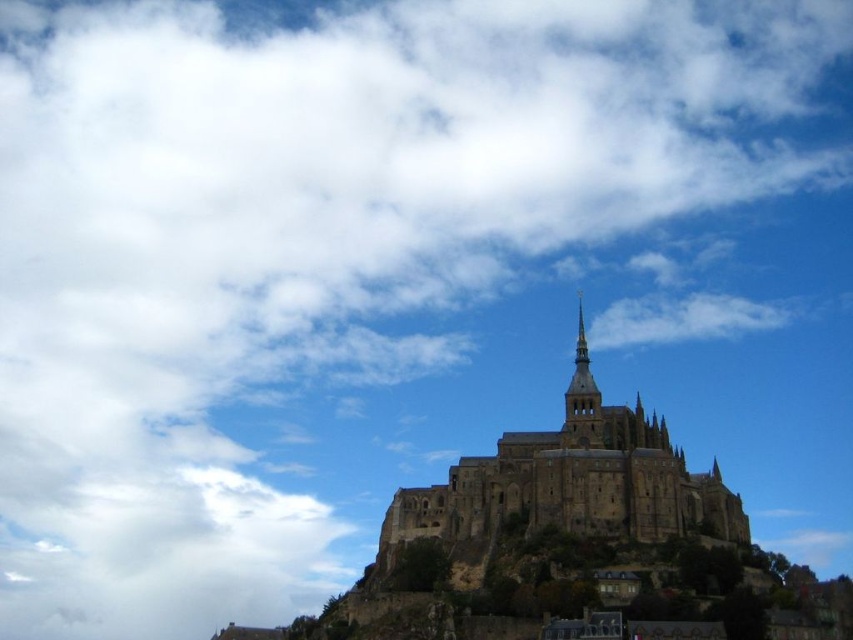
Who is more distant from viewer, (714, 464) or (567, 429)?

Positioned behind is point (567, 429).

Can you confirm if brown stone castle at center is shorter than golden stone spire at center?

Incorrect, brown stone castle at center's height does not fall short of golden stone spire at center's.

Locate an element on the screen. The width and height of the screenshot is (853, 640). brown stone castle at center is located at coordinates (569, 483).